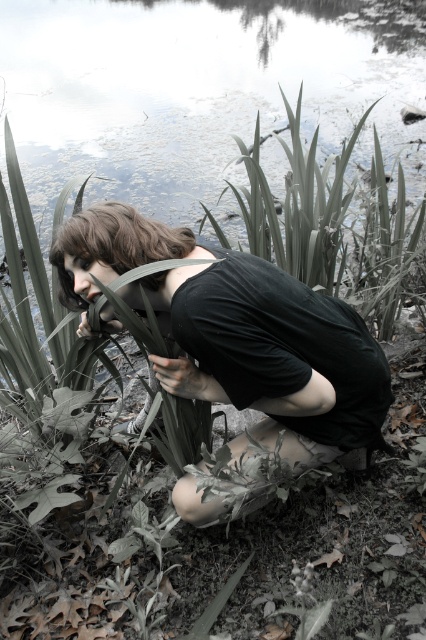
You are a wildlife photographer observing the scene from a distance. You notice the black matte shirt at center and the dark brown hair at center. Which object is positioned lower in the image?

The black matte shirt at center is located below dark brown hair at center, so the black matte shirt at center is positioned lower in the image.

You are a photographer trying to capture the scene. You notice two points in the image at coordinates point (60, 260) and point (146, 259). Which point is closer to your camera lens?

Point (60, 260) is further to the camera than point (146, 259), so the point closer to the camera lens is point (146, 259).

You are a photographer trying to capture a closeup of the dark brown hair at center and the black matte shirt at center. Which object should you focus on first if you want to ensure both are in focus, considering their positions relative to each other?

The dark brown hair at center should be focused on first since it is closer to the camera than the black matte shirt at center, ensuring both will be in focus when using depth of field appropriately.